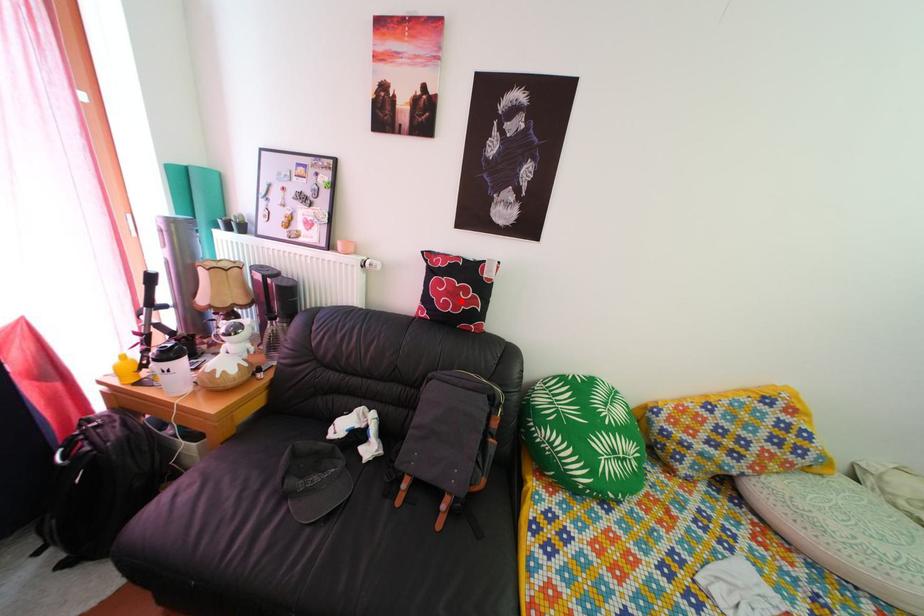
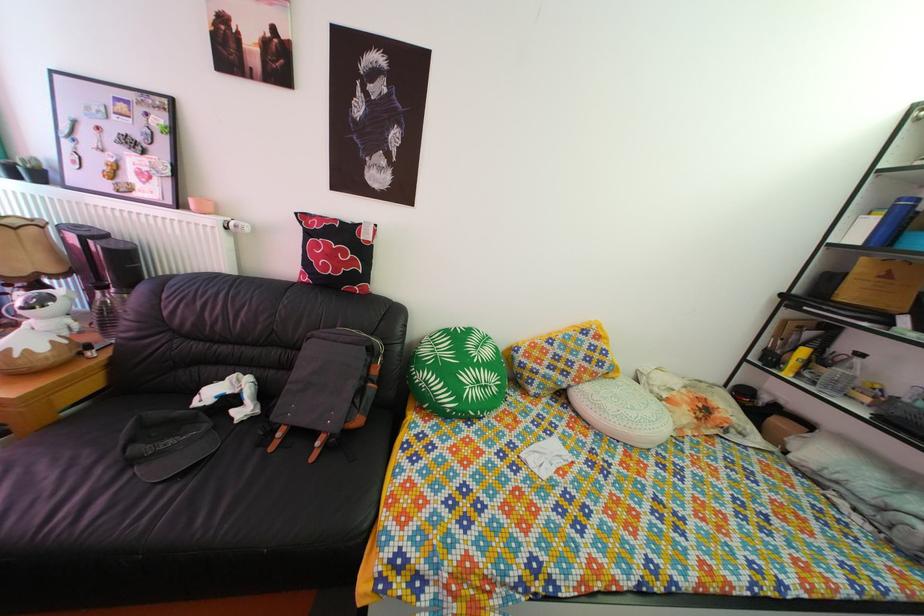
Where in the second image is the point corresponding to the highlighted location from the first image?

(338, 264)